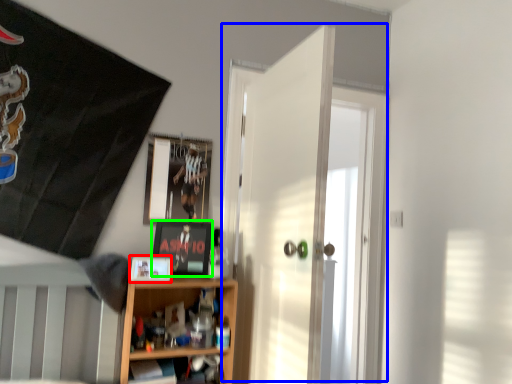
Question: Considering the real-world distances, which object is closest to picture frame (highlighted by a red box)? door (highlighted by a blue box) or picture frame (highlighted by a green box).

Choices:
 (A) door
 (B) picture frame

Answer: (B)